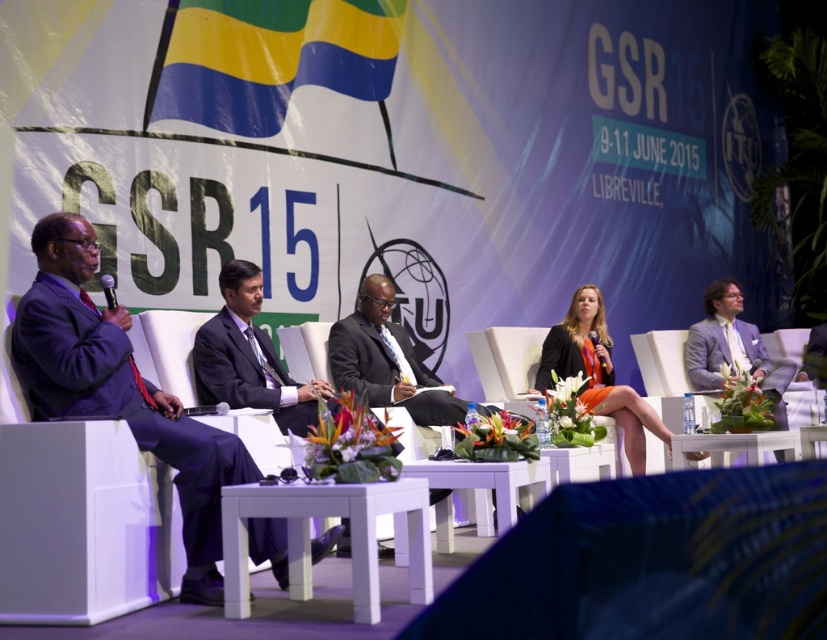
You are an event photographer at the GSR15 conference. You need to capture a photo where the dark suit at center and the metallic silver microphone at left are both clearly visible. Considering their sizes, which object will appear larger in the photo?

The dark suit at center will appear larger in the photo because it is much taller than the metallic silver microphone at left.

You are organizing a photo shoot for the event and need to ensure the dark suit at center and the metallic silver microphone at left are visible in the frame. Based on their sizes, which object should you prioritize placing closer to the camera to maintain detail?

The dark suit at center should be placed closer to the camera since its width is larger than the metallic silver microphone at left, ensuring both objects remain detailed in the photo.